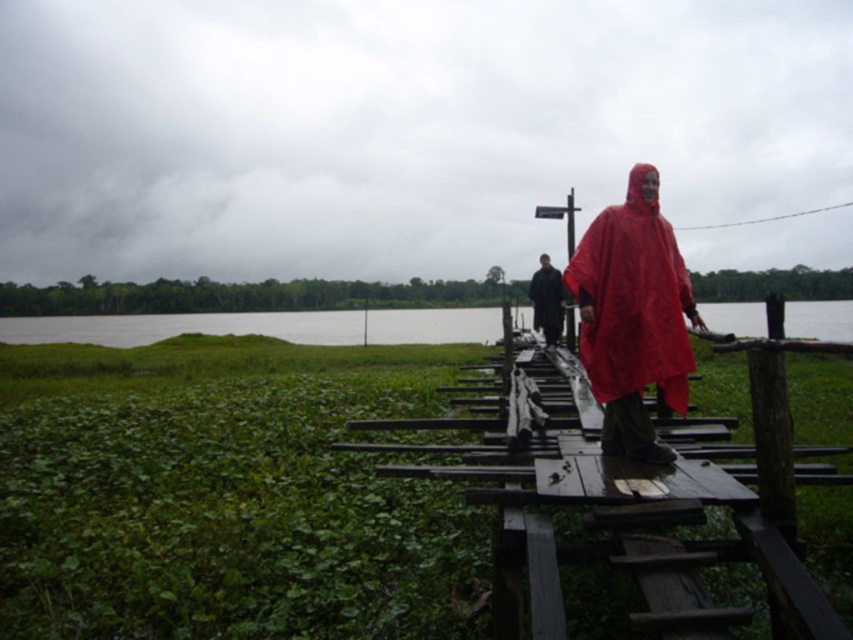
You are standing at the entrance of the wooden walkway in a wetland area. You notice a matte red poncho at center. Based on its position, can you determine if it is closer to the start of the walkway or further along the path?

The matte red poncho at center is located at point (633, 316), which places it closer to the start of the walkway rather than further along the path.

You are standing on the wooden walkway in the wetland scene and want to place a small marker at both point [566,472] and point [537,314]. Which point will appear larger in your view?

Point [566,472] is closer to the camera than point [537,314], so the marker at point [566,472] will appear larger in your view.